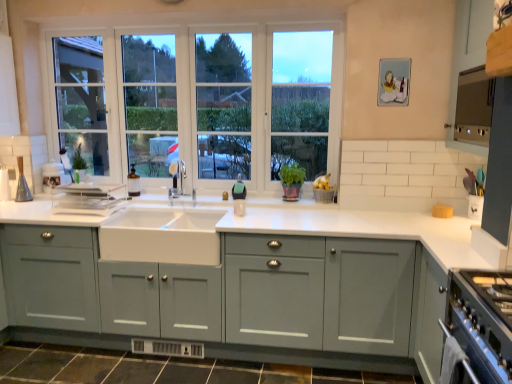
Question: Is matte gray cabinets at center, acting as the first cabinetry starting from the left, not within brown tile at lower center?

Choices:
 (A) no
 (B) yes

Answer: (B)

Question: Does matte gray cabinets at center, the 2th cabinetry from the right, have a smaller size compared to brown tile at lower center?

Choices:
 (A) no
 (B) yes

Answer: (A)

Question: Does matte gray cabinets at center, the 2th cabinetry in the top-to-bottom sequence, come behind brown tile at lower center?

Choices:
 (A) no
 (B) yes

Answer: (B)

Question: Considering the relative sizes of matte gray cabinets at center, the 2th cabinetry in the top-to-bottom sequence, and brown tile at lower center in the image provided, is matte gray cabinets at center, the 2th cabinetry in the top-to-bottom sequence, taller than brown tile at lower center?

Choices:
 (A) yes
 (B) no

Answer: (A)

Question: Can you confirm if matte gray cabinets at center, the 2th cabinetry in the top-to-bottom sequence, is wider than brown tile at lower center?

Choices:
 (A) yes
 (B) no

Answer: (A)

Question: Is matte gray cabinets at center, the 2th cabinetry from the right, not close to brown tile at lower center?

Choices:
 (A) yes
 (B) no

Answer: (B)

Question: Is satin nickel faucet at center at the right side of satin stainless steel range hood at upper right?

Choices:
 (A) yes
 (B) no

Answer: (B)

Question: Can you confirm if satin nickel faucet at center is smaller than satin stainless steel range hood at upper right?

Choices:
 (A) no
 (B) yes

Answer: (B)

Question: Would you say satin nickel faucet at center is outside satin stainless steel range hood at upper right?

Choices:
 (A) no
 (B) yes

Answer: (B)

Question: Is satin stainless steel range hood at upper right surrounded by satin nickel faucet at center?

Choices:
 (A) no
 (B) yes

Answer: (A)

Question: Is satin nickel faucet at center to the left of satin stainless steel range hood at upper right from the viewer's perspective?

Choices:
 (A) no
 (B) yes

Answer: (B)

Question: Is satin nickel faucet at center oriented away from satin stainless steel range hood at upper right?

Choices:
 (A) no
 (B) yes

Answer: (A)

Question: Is satin stainless steel range hood at upper right to the left of white ceramic sink at center from the viewer's perspective?

Choices:
 (A) yes
 (B) no

Answer: (B)